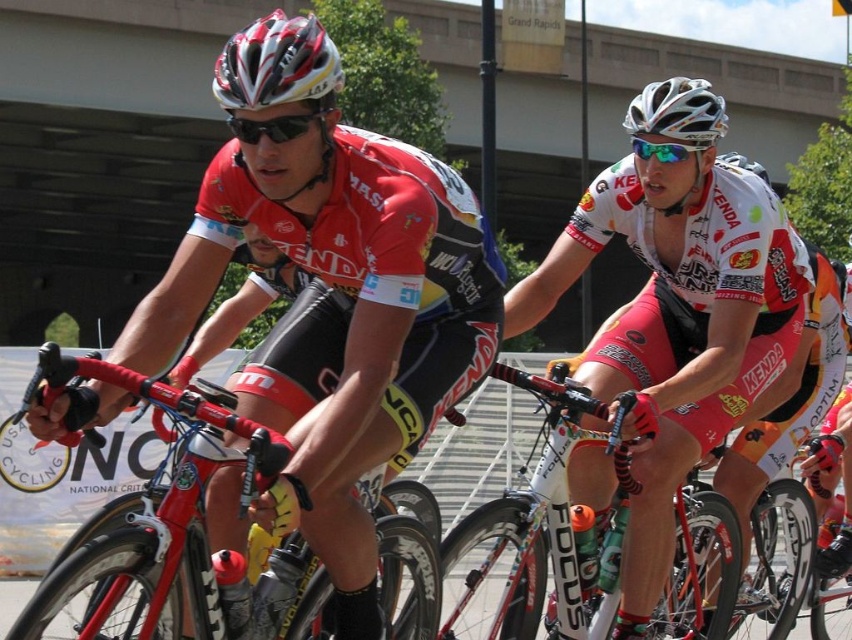
What object is located at the coordinates point [676,324]?

The white matte helmet at upper center is located at point [676,324].

You are a photographer positioned at the starting line of the race. You want to take a photo that includes both the point at coordinates point [674,192] and point [492,580]. Which point should you focus on first to ensure both are in sharp focus?

You should focus on point [674,192] first because it is closer to the viewer. This ensures that both points will be in focus as the depth of field will cover the farther point [492,580].